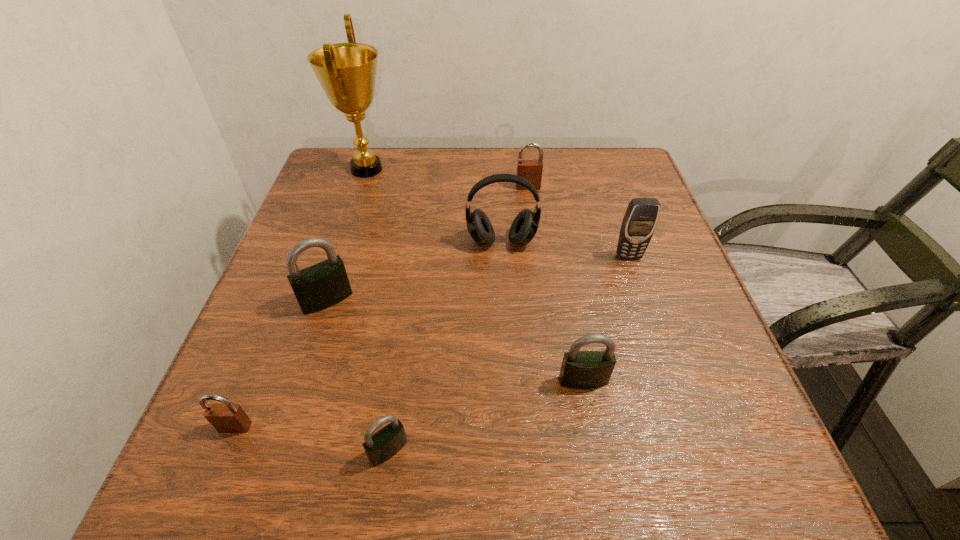
Identify the location of gold award. (347, 72).

Find the location of a particular element. the tallest object is located at coordinates (347, 72).

Image resolution: width=960 pixels, height=540 pixels. Find the location of `black headset`. black headset is located at coordinates pos(525,225).

Image resolution: width=960 pixels, height=540 pixels. I want to click on the leftmost black padlock, so [x=320, y=286].

At what (x,y) coordinates should I click in order to perform the action: click on the fourth nearest padlock. Please return your answer as a coordinate pair (x, y). The image size is (960, 540). Looking at the image, I should click on (320, 286).

Locate an element on the screen. This screenshot has width=960, height=540. the rightmost object is located at coordinates (640, 219).

This screenshot has height=540, width=960. In order to click on the farthest padlock in this screenshot , I will do `click(531, 170)`.

Identify the location of the farther brown padlock. (531, 170).

Find the location of a particular element. the second nearest black padlock is located at coordinates (580, 369).

Where is `the third farthest padlock`? The height and width of the screenshot is (540, 960). the third farthest padlock is located at coordinates (580, 369).